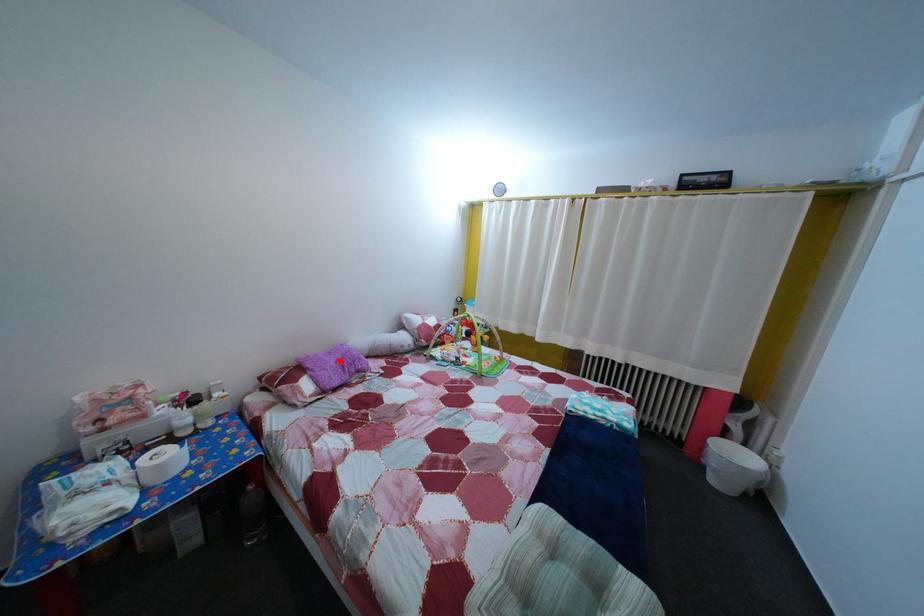
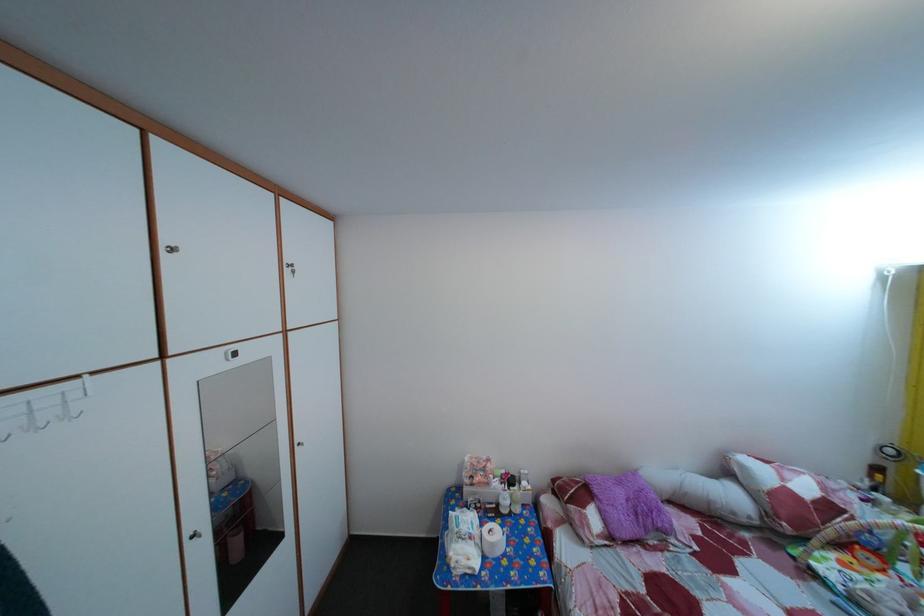
In the second image, find the point that corresponds to the highlighted location in the first image.

(629, 491)